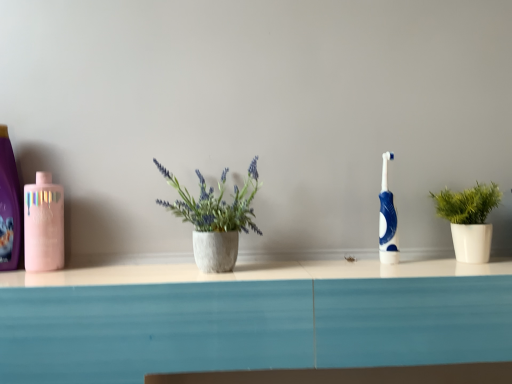
You are a GUI agent. You are given a task and a screenshot of the screen. Output one action in this format:
    pyautogui.click(x=<x>, y=<y>)
    Task: Click on the matte pink bottle at left
    The width and height of the screenshot is (512, 384).
    Given the screenshot: What is the action you would take?
    pyautogui.click(x=9, y=206)

What do you see at coordinates (42, 224) in the screenshot?
I see `pink glossy mouthwash at left` at bounding box center [42, 224].

I want to click on white matte plant pot at right, so click(469, 219).

Between pink glossy mouthwash at left and blue glossy toothbrush at center-right, which one has less height?

With less height is pink glossy mouthwash at left.

Which of these two, pink glossy mouthwash at left or blue glossy toothbrush at center-right, is smaller?

blue glossy toothbrush at center-right.

Is pink glossy mouthwash at left oriented away from blue glossy toothbrush at center-right?

No, pink glossy mouthwash at left's orientation is not away from blue glossy toothbrush at center-right.

Which object is further away from the camera taking this photo, pink glossy mouthwash at left or blue glossy toothbrush at center-right?

Positioned behind is blue glossy toothbrush at center-right.

Is matte pink bottle at left in front of or behind white matte plant pot at right in the image?

matte pink bottle at left is positioned farther from the viewer than white matte plant pot at right.

From the image's perspective, does matte pink bottle at left appear lower than white matte plant pot at right?

No, from the image's perspective, matte pink bottle at left is not below white matte plant pot at right.

How different are the orientations of matte pink bottle at left and white matte plant pot at right in degrees?

They differ by 4.82 degrees in their facing directions.

Measure the distance from matte pink bottle at left to white matte plant pot at right.

33.72 inches.

Locate an element on the screen. Image resolution: width=512 pixels, height=384 pixels. mouthwash above the white matte plant pot at right (from the image's perspective) is located at coordinates (42, 224).

Is white matte plant pot at right bigger or smaller than pink glossy mouthwash at left?

Clearly, white matte plant pot at right is larger in size than pink glossy mouthwash at left.

Is white matte plant pot at right completely or partially inside pink glossy mouthwash at left?

No, white matte plant pot at right is not a part of pink glossy mouthwash at left.

Does pink glossy mouthwash at left have a greater height compared to white matte plant pot at right?

Indeed, pink glossy mouthwash at left has a greater height compared to white matte plant pot at right.

From the picture: Considering the relative sizes of pink glossy mouthwash at left and white matte plant pot at right in the image provided, is pink glossy mouthwash at left wider than white matte plant pot at right?

Incorrect, the width of pink glossy mouthwash at left does not surpass that of white matte plant pot at right.

Locate an element on the screen. mouthwash above the white matte plant pot at right (from a real-world perspective) is located at coordinates (42, 224).

Can you confirm if white matte plant pot at right is positioned to the left of blue glossy toothbrush at center-right?

In fact, white matte plant pot at right is to the right of blue glossy toothbrush at center-right.

Are white matte plant pot at right and blue glossy toothbrush at center-right making contact?

white matte plant pot at right is not next to blue glossy toothbrush at center-right, and they're not touching.

Between white matte plant pot at right and blue glossy toothbrush at center-right, which one has larger width?

white matte plant pot at right.

Is point (475, 230) in front of point (382, 243)?

Yes, point (475, 230) is in front of point (382, 243).

I want to click on toothbrush behind the pink glossy mouthwash at left, so click(x=387, y=218).

Would you say pink glossy mouthwash at left is part of blue glossy toothbrush at center-right's contents?

No, blue glossy toothbrush at center-right does not contain pink glossy mouthwash at left.

From a real-world perspective, is blue glossy toothbrush at center-right under pink glossy mouthwash at left?

No, from a real-world perspective, blue glossy toothbrush at center-right is not below pink glossy mouthwash at left.

Is white matte plant pot at right not near matte pink bottle at left?

No, white matte plant pot at right is not far from matte pink bottle at left.

Does white matte plant pot at right have a lesser height compared to matte pink bottle at left?

Correct, white matte plant pot at right is not as tall as matte pink bottle at left.

From the picture: How many degrees apart are the facing directions of white matte plant pot at right and matte pink bottle at left?

The facing directions of white matte plant pot at right and matte pink bottle at left are 4.82 degrees apart.

Is white matte plant pot at right oriented away from matte pink bottle at left?

No.

In order to click on mouthwash in front of the blue glossy toothbrush at center-right in this screenshot , I will do `click(42, 224)`.

The width and height of the screenshot is (512, 384). Identify the location of cleaning product that appears on the left of white matte plant pot at right. (9, 206).

Which object lies further to the anchor point matte pink bottle at left, white matte plant pot at right or blue glossy toothbrush at center-right?

The object further to matte pink bottle at left is white matte plant pot at right.

From the image, which object appears to be farther from blue glossy toothbrush at center-right, white matte plant pot at right or matte pink bottle at left?

matte pink bottle at left is positioned further to the anchor blue glossy toothbrush at center-right.

When comparing their distances from white matte plant pot at right, does blue glossy toothbrush at center-right or matte pink bottle at left seem further?

Based on the image, matte pink bottle at left appears to be further to white matte plant pot at right.

When comparing their distances from pink glossy mouthwash at left, does blue glossy toothbrush at center-right or white matte plant pot at right seem closer?

blue glossy toothbrush at center-right.

From the image, which object appears to be nearer to white matte plant pot at right, matte pink bottle at left or pink glossy mouthwash at left?

Based on the image, pink glossy mouthwash at left appears to be nearer to white matte plant pot at right.

Based on the photo, looking at the image, which one is located further to matte pink bottle at left, pink glossy mouthwash at left or white matte plant pot at right?

white matte plant pot at right is further to matte pink bottle at left.

Considering their positions, is pink glossy mouthwash at left positioned further to blue glossy toothbrush at center-right than white matte plant pot at right?

Among the two, pink glossy mouthwash at left is located further to blue glossy toothbrush at center-right.

From the image, which object appears to be farther from pink glossy mouthwash at left, matte pink bottle at left or blue glossy toothbrush at center-right?

blue glossy toothbrush at center-right is further to pink glossy mouthwash at left.

The height and width of the screenshot is (384, 512). Identify the location of mouthwash between matte pink bottle at left and white matte plant pot at right from left to right. (42, 224).

This screenshot has height=384, width=512. I want to click on mouthwash between matte pink bottle at left and blue glossy toothbrush at center-right, so click(x=42, y=224).

This screenshot has height=384, width=512. I want to click on toothbrush between pink glossy mouthwash at left and white matte plant pot at right from left to right, so [387, 218].

This screenshot has width=512, height=384. Find the location of `toothbrush between matte pink bottle at left and white matte plant pot at right from left to right`. toothbrush between matte pink bottle at left and white matte plant pot at right from left to right is located at coordinates (387, 218).